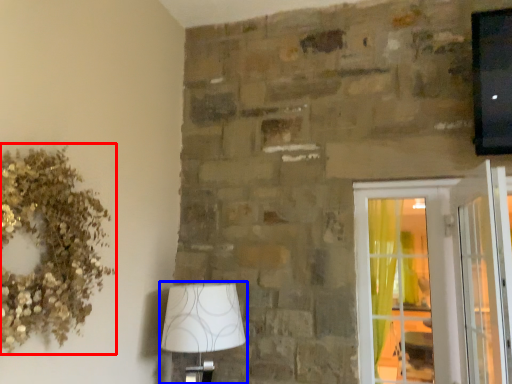
Question: Which of the following is the farthest to the observer, floral arrangement (highlighted by a red box) or lamp (highlighted by a blue box)?

Choices:
 (A) floral arrangement
 (B) lamp

Answer: (B)